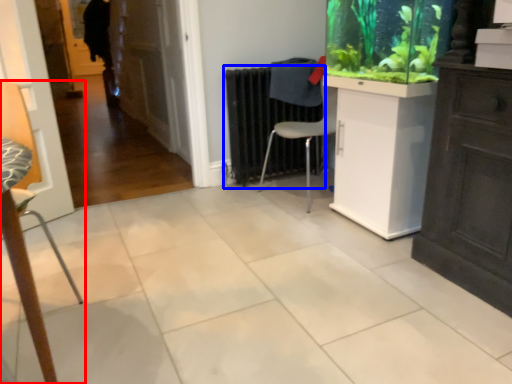
Question: Which object appears closest to the camera in this image, chair (highlighted by a red box) or radiator (highlighted by a blue box)?

Choices:
 (A) chair
 (B) radiator

Answer: (A)